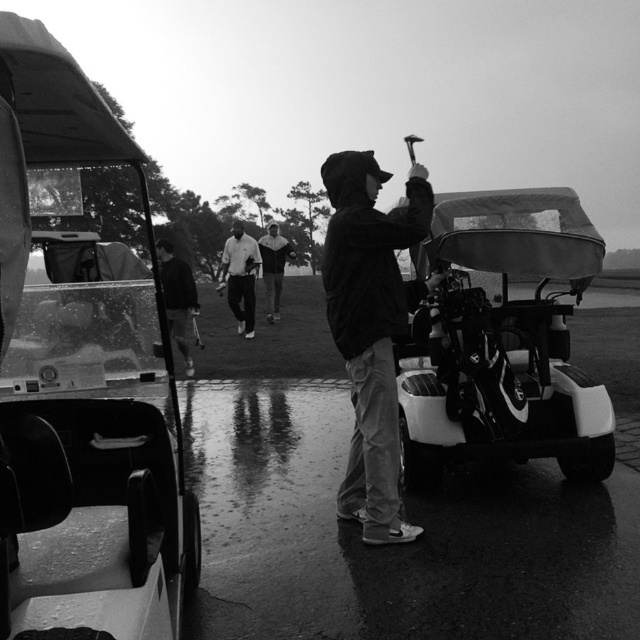
You are a photographer trying to capture a clear shot of both the metallic golf cart at left and the dark fabric jacket at left. Since the camera can only focus on one subject at a time, which object should you choose to ensure the other remains in the background without being too blurry?

The metallic golf cart at left is much taller than the dark fabric jacket at left, so focusing on the metallic golf cart at left would keep the dark fabric jacket at left in the background with less blur.

You are a golfer standing at the starting point of the golf course. You see two points marked on the map as point 1 at coordinates (408, 237) and point 2 at coordinates (227, 241). Which point is closer to you?

Point 1 at coordinates (408, 237) is closer to you because it is in front of point 2 at coordinates (227, 241).